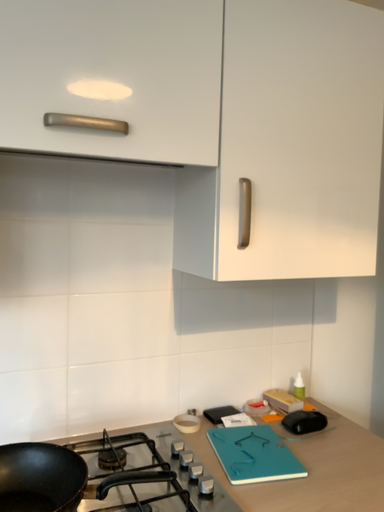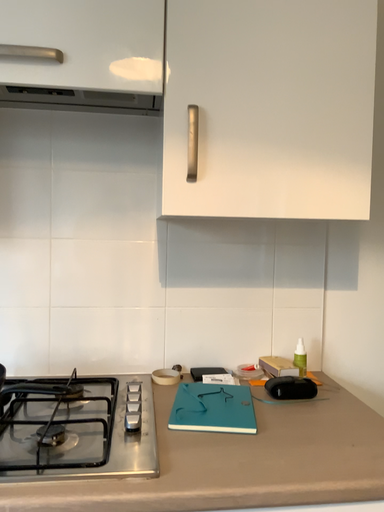
Question: Which way did the camera rotate in the video?

Choices:
 (A) rotated right
 (B) rotated left

Answer: (B)